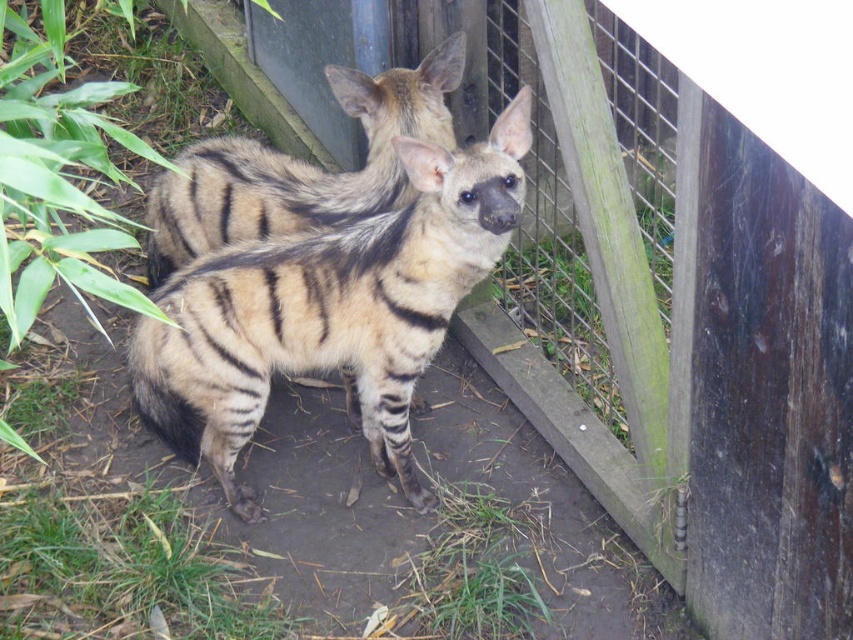
Consider the image. You are a zookeeper who needs to place a divider between two striped hyenas in the enclosure. The divider must be placed exactly halfway between them. Given their current positions at point (492, 192), where should you place the divider?

The divider should be placed exactly halfway between the two striped hyenas. Since they are 8.46 feet apart, the midpoint would be at 4.23 feet from each hyena.

You are a zookeeper planning to feed the striped fur hyaena at center. You have a food tray that needs to be placed on the wooden fence at center. Can you place the food directly in front of the hyaena without the fence blocking the hyaena from reaching it?

The wooden fence at center is in front of striped fur hyaena at center, so placing the food on the fence would block the hyaena from reaching it. You should place the food on the ground near the hyaena instead.

From the picture: You are a zookeeper observing two striped fur hyenas in the enclosure. You notice both the striped fur hyaena at center and the striped fur hyena at center. Which one is taller?

The striped fur hyaena at center is taller than the striped fur hyena at center according to the description.